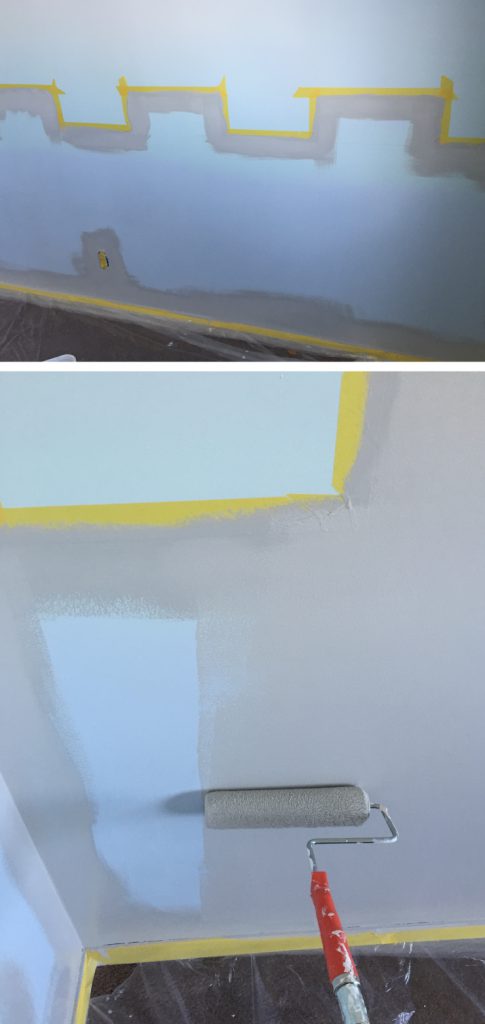
You are a GUI agent. You are given a task and a screenshot of the screen. Output one action in this format:
    pyautogui.click(x=<x>, y=<y>)
    Task: Click on the shadow to the left of paint roller
    
    Given the screenshot: What is the action you would take?
    pyautogui.click(x=191, y=803)